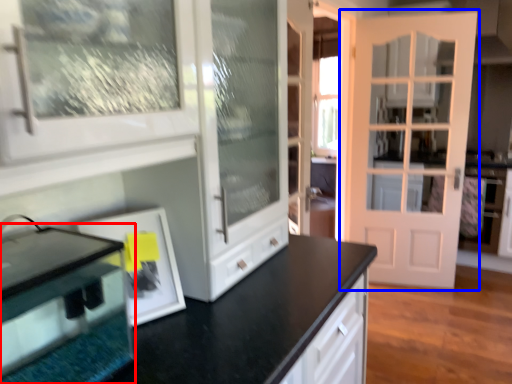
Question: Among these objects, which one is nearest to the camera, appliance (highlighted by a red box) or door (highlighted by a blue box)?

Choices:
 (A) appliance
 (B) door

Answer: (A)